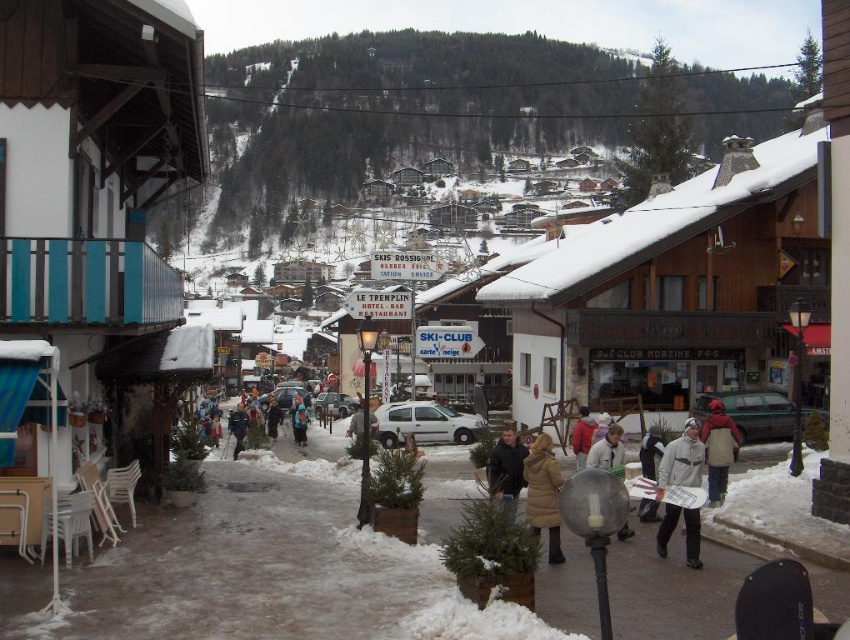
Looking at this image, between white snowboard at center and red jacket at center, which one has less height?

red jacket at center is shorter.

Which is above, white snowboard at center or red jacket at center?

white snowboard at center is above.

Is point (646, 518) positioned in front of point (581, 428)?

Yes, point (646, 518) is in front of point (581, 428).

At what (x,y) coordinates should I click in order to perform the action: click on white snowboard at center. Please return your answer as a coordinate pair (x, y). Looking at the image, I should click on (650, 452).

Based on the photo, measure the distance between point [688,554] and camera.

Point [688,554] and camera are 32.72 meters apart from each other.

Is point (697, 560) closer to viewer compared to point (658, 454)?

That is True.

The image size is (850, 640). Identify the location of gray woolen jacket at center. (683, 458).

Is point (660, 435) positioned behind point (242, 419)?

No.

Is point (656, 429) positioned in front of point (241, 438)?

That is True.

Between point (646, 512) and point (231, 433), which one is positioned behind?

The point (231, 433) is more distant.

The height and width of the screenshot is (640, 850). I want to click on white snowboard at center, so click(x=650, y=452).